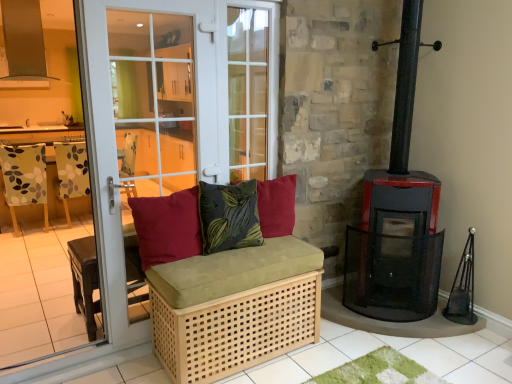
Question: Does natural wood woven basket at lower center have a greater width compared to black metal wood burning stove at right?

Choices:
 (A) no
 (B) yes

Answer: (B)

Question: Is natural wood woven basket at lower center thinner than black metal wood burning stove at right?

Choices:
 (A) yes
 (B) no

Answer: (B)

Question: Could you tell me if natural wood woven basket at lower center is facing black metal wood burning stove at right?

Choices:
 (A) yes
 (B) no

Answer: (B)

Question: Is natural wood woven basket at lower center with black metal wood burning stove at right?

Choices:
 (A) yes
 (B) no

Answer: (B)

Question: Is natural wood woven basket at lower center not inside black metal wood burning stove at right?

Choices:
 (A) yes
 (B) no

Answer: (A)

Question: From a real-world perspective, is natural wood woven basket at lower center below black metal wood burning stove at right?

Choices:
 (A) no
 (B) yes

Answer: (B)

Question: Can you confirm if matte red cushion at center, marked as the 1th pillow in a left-to-right arrangement, is wider than white glass door at left?

Choices:
 (A) no
 (B) yes

Answer: (B)

Question: Can you confirm if matte red cushion at center, which appears as the 3th pillow when viewed from the right, is taller than white glass door at left?

Choices:
 (A) yes
 (B) no

Answer: (B)

Question: From a real-world perspective, is matte red cushion at center, marked as the 1th pillow in a left-to-right arrangement, beneath white glass door at left?

Choices:
 (A) no
 (B) yes

Answer: (B)

Question: Does matte red cushion at center, marked as the 1th pillow in a left-to-right arrangement, appear on the right side of white glass door at left?

Choices:
 (A) no
 (B) yes

Answer: (B)

Question: Does matte red cushion at center, which appears as the 3th pillow when viewed from the right, have a lesser height compared to white glass door at left?

Choices:
 (A) yes
 (B) no

Answer: (A)

Question: Can you confirm if velvet green pillow at center, which is the 2th pillow from left to right, is positioned to the right of black metal wood burning stove at right?

Choices:
 (A) yes
 (B) no

Answer: (B)